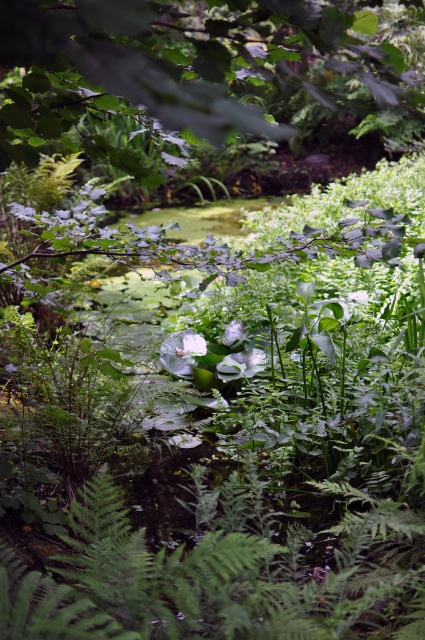
Who is positioned more to the left, green leafy tree at upper center or white matte flower at center?

Positioned to the left is white matte flower at center.

I want to click on green leafy tree at upper center, so click(181, 64).